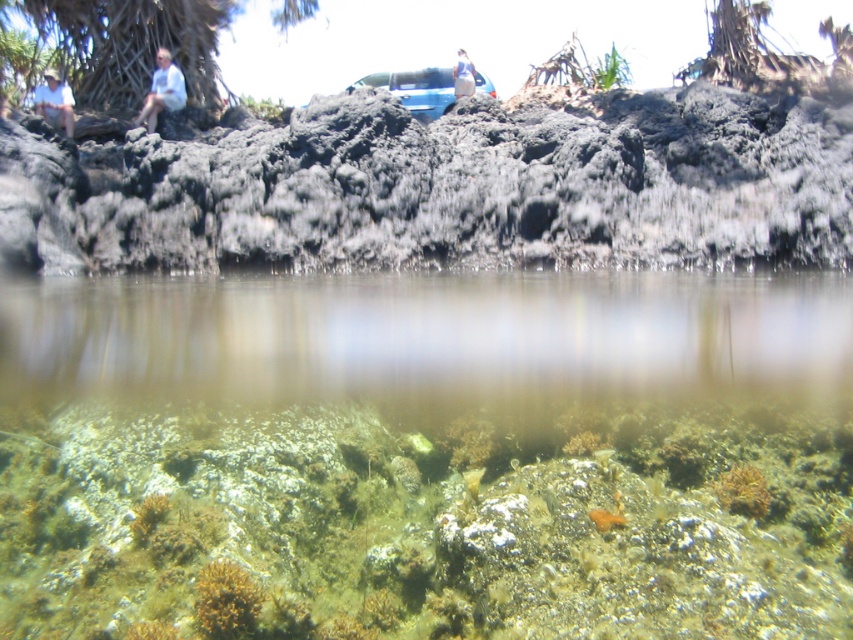
Is green algae at center wider than light blue shirt at upper left?

Indeed, green algae at center has a greater width compared to light blue shirt at upper left.

Can you confirm if green algae at center is positioned to the right of light blue shirt at upper left?

Correct, you'll find green algae at center to the right of light blue shirt at upper left.

Is point (728, 388) in front of point (161, 97)?

Yes, point (728, 388) is closer to viewer.

Locate an element on the screen. This screenshot has width=853, height=640. green algae at center is located at coordinates (432, 340).

Does green algae at center lie in front of brown coral at lower center?

Yes, green algae at center is in front of brown coral at lower center.

Who is taller, green algae at center or brown coral at lower center?

green algae at center

Find the location of `green algae at center`. green algae at center is located at coordinates (432, 340).

Where is `green algae at center`? This screenshot has width=853, height=640. green algae at center is located at coordinates (432, 340).

What do you see at coordinates (741, 492) in the screenshot? This screenshot has height=640, width=853. I see `orange coral at lower center` at bounding box center [741, 492].

How far apart are orange coral at lower center and light blue shirt at upper left?

orange coral at lower center is 30.07 feet from light blue shirt at upper left.

Find the location of a particular element. The height and width of the screenshot is (640, 853). orange coral at lower center is located at coordinates (741, 492).

Where is `orange coral at lower center`? orange coral at lower center is located at coordinates (741, 492).